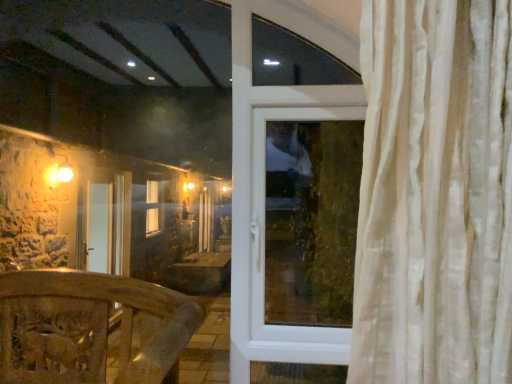
Question: From their relative heights in the image, would you say transparent glass window at center is taller or shorter than wooden carved railing at lower left?

Choices:
 (A) short
 (B) tall

Answer: (B)

Question: From the image's perspective, is transparent glass window at center above or below wooden carved railing at lower left?

Choices:
 (A) below
 (B) above

Answer: (B)

Question: Choose the correct answer: Is transparent glass window at center inside wooden carved railing at lower left or outside it?

Choices:
 (A) inside
 (B) outside

Answer: (B)

Question: In terms of height, does wooden carved railing at lower left look taller or shorter compared to transparent glass window at center?

Choices:
 (A) short
 (B) tall

Answer: (A)

Question: Does point (117, 377) appear closer or farther from the camera than point (262, 215)?

Choices:
 (A) farther
 (B) closer

Answer: (B)

Question: Is wooden carved railing at lower left inside or outside of transparent glass window at center?

Choices:
 (A) inside
 (B) outside

Answer: (B)

Question: Considering their positions, is wooden carved railing at lower left located in front of or behind transparent glass window at center?

Choices:
 (A) front
 (B) behind

Answer: (A)